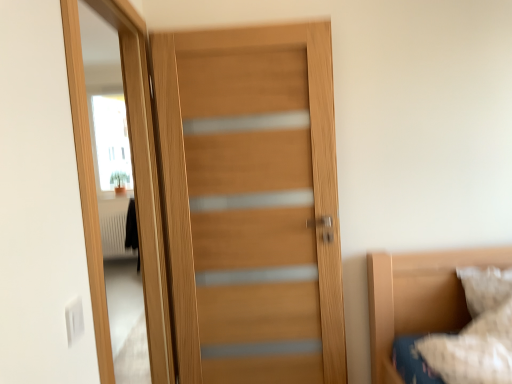
You are a GUI agent. You are given a task and a screenshot of the screen. Output one action in this format:
    pyautogui.click(x=<x>, y=<y>)
    Task: Click on the wooden door at center
    
    Given the screenshot: What is the action you would take?
    pyautogui.click(x=251, y=203)

From the picture: Are wooden door at left and wooden door at center far apart?

They are positioned close to each other.

From the image's perspective, between wooden door at left and wooden door at center, which one is located above?

wooden door at left, from the image's perspective.

Which of these two, wooden door at left or wooden door at center, stands taller?

wooden door at left is taller.

Is wooden door at left positioned beyond the bounds of wooden door at center?

Absolutely, wooden door at left is external to wooden door at center.

Which is more to the right, white textured pillow at lower right or wooden door at center?

white textured pillow at lower right is more to the right.

Which object is thinner, white textured pillow at lower right or wooden door at center?

Thinner between the two is wooden door at center.

Is white textured pillow at lower right bigger than wooden door at center?

Incorrect, white textured pillow at lower right is not larger than wooden door at center.

Is white textured pillow at lower right taller or shorter than wooden door at center?

In the image, white textured pillow at lower right appears to be shorter than wooden door at center.

From the image's perspective, is wooden door at center under wooden door at left?

Yes, from the image's perspective, wooden door at center is beneath wooden door at left.

What's the angular difference between wooden door at center and wooden door at left's facing directions?

The angular difference between wooden door at center and wooden door at left is 95.9 degrees.

From a real-world perspective, who is located lower, wooden door at center or wooden door at left?

wooden door at center is physically lower.

Visually, is wooden door at center positioned to the left or to the right of wooden door at left?

From the image, it's evident that wooden door at center is to the right of wooden door at left.

From a real-world perspective, is white textured pillow at lower right on top of wooden door at left?

No.

Is white textured pillow at lower right positioned far away from wooden door at left?

white textured pillow at lower right is far away from wooden door at left.

Looking at this image, who is smaller, white textured pillow at lower right or wooden door at left?

white textured pillow at lower right is smaller.

Which is correct: white textured pillow at lower right is inside wooden door at left, or outside of it?

white textured pillow at lower right lies outside wooden door at left.

Which is in front, point (295, 340) or point (468, 271)?

Point (468, 271)

From a real-world perspective, who is located lower, wooden door at center or white textured pillow at lower right?

In real-world perspective, white textured pillow at lower right is lower.

From the image's perspective, between wooden door at center and white textured pillow at lower right, who is located below?

white textured pillow at lower right.

Which is in front, wooden door at center or white textured pillow at lower right?

Positioned in front is wooden door at center.

Is wooden door at left to the left or to the right of white textured pillow at lower right in the image?

wooden door at left is positioned on white textured pillow at lower right's left side.

Is wooden door at left aimed at white textured pillow at lower right?

Yes, wooden door at left is turned towards white textured pillow at lower right.

From a real-world perspective, is wooden door at left positioned above or below white textured pillow at lower right?

From a real-world perspective, wooden door at left is physically above white textured pillow at lower right.

Can you confirm if wooden door at left is thinner than white textured pillow at lower right?

Correct, the width of wooden door at left is less than that of white textured pillow at lower right.

The height and width of the screenshot is (384, 512). In order to click on screen door above the wooden door at center (from a real-world perspective) in this screenshot , I will do `click(144, 182)`.

Where is `door located in front of the white textured pillow at lower right`? door located in front of the white textured pillow at lower right is located at coordinates (251, 203).

Based on their spatial positions, is white textured pillow at lower right or wooden door at left closer to wooden door at center?

Among the two, wooden door at left is located nearer to wooden door at center.

Estimate the real-world distances between objects in this image. Which object is further from wooden door at left, white textured pillow at lower right or wooden door at center?

white textured pillow at lower right is further to wooden door at left.

Estimate the real-world distances between objects in this image. Which object is further from wooden door at center, wooden door at left or white textured pillow at lower right?

white textured pillow at lower right is positioned further to the anchor wooden door at center.

When comparing their distances from white textured pillow at lower right, does wooden door at center or wooden door at left seem further?

wooden door at left.

Based on their spatial positions, is wooden door at center or white textured pillow at lower right closer to wooden door at left?

The object closer to wooden door at left is wooden door at center.

Which object lies nearer to the anchor point white textured pillow at lower right, wooden door at left or wooden door at center?

wooden door at center lies closer to white textured pillow at lower right than the other object.

Where is `door between wooden door at left and white textured pillow at lower right in the horizontal direction`? door between wooden door at left and white textured pillow at lower right in the horizontal direction is located at coordinates (251, 203).